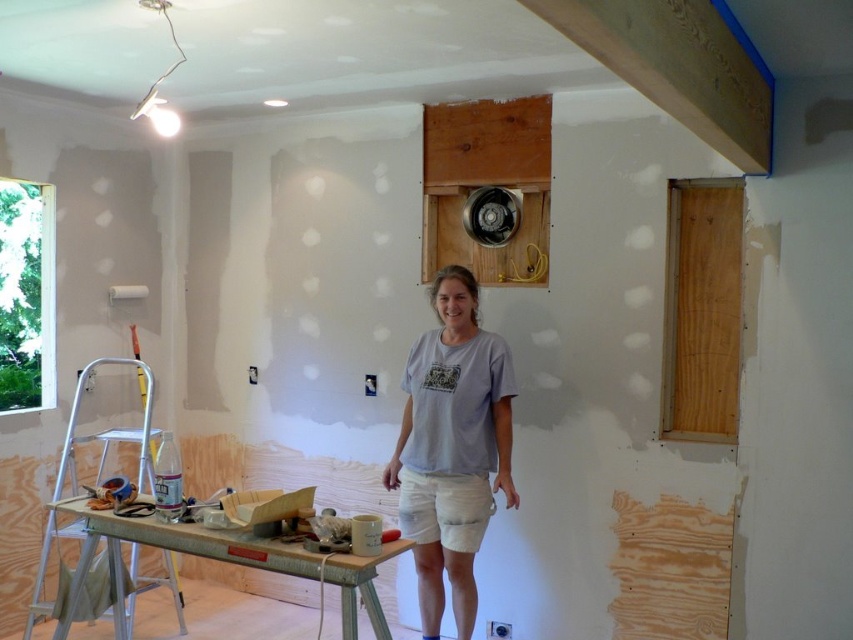
You are standing in the room and want to reach a specific point marked at coordinates point (663, 93). If your arm can extend 5 feet, can you reach that point without moving?

The distance of point (663, 93) from camera is 6.28 feet, so no, you cannot reach it with an arm extension of 5 feet as it is farther away.